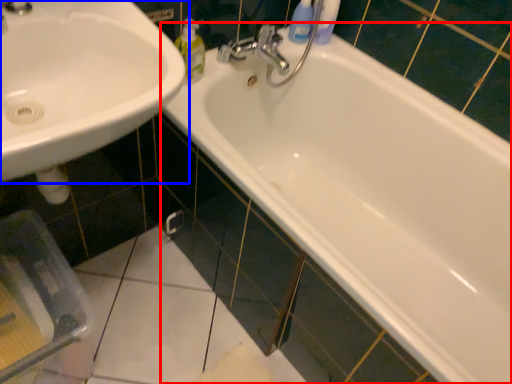
Question: Which object appears closest to the camera in this image, bathtub (highlighted by a red box) or sink (highlighted by a blue box)?

Choices:
 (A) bathtub
 (B) sink

Answer: (B)